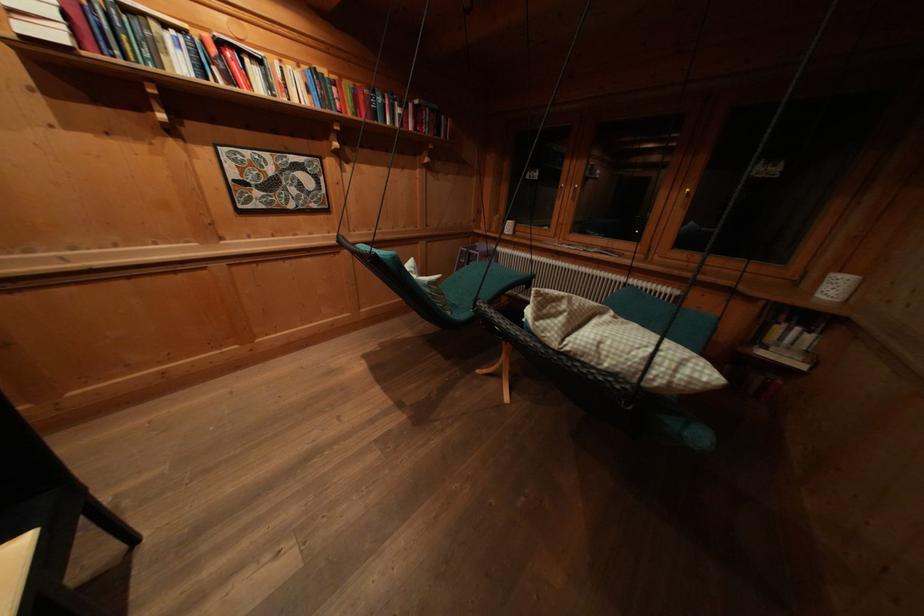
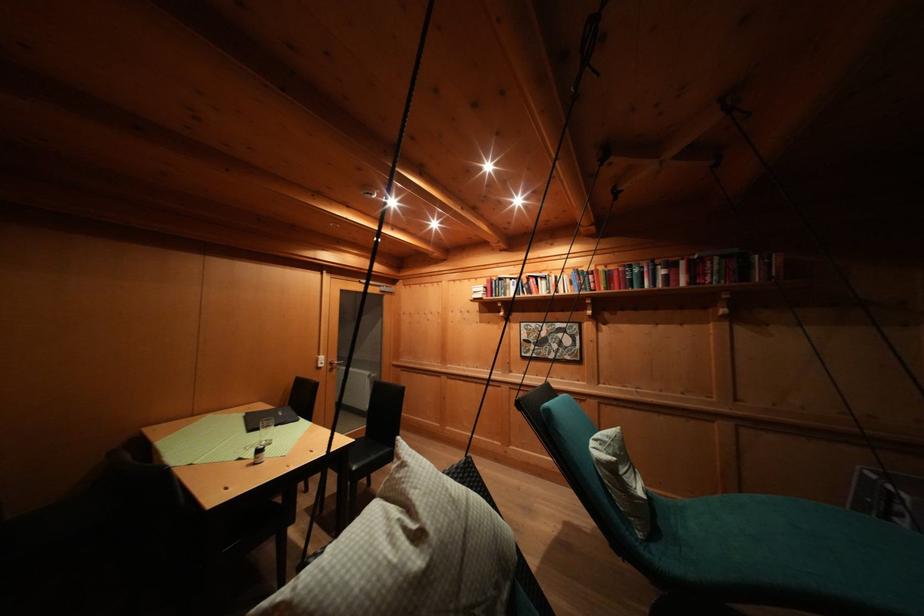
Where in the second image is the point corresponding to point (160, 30) from the first image?

(514, 285)